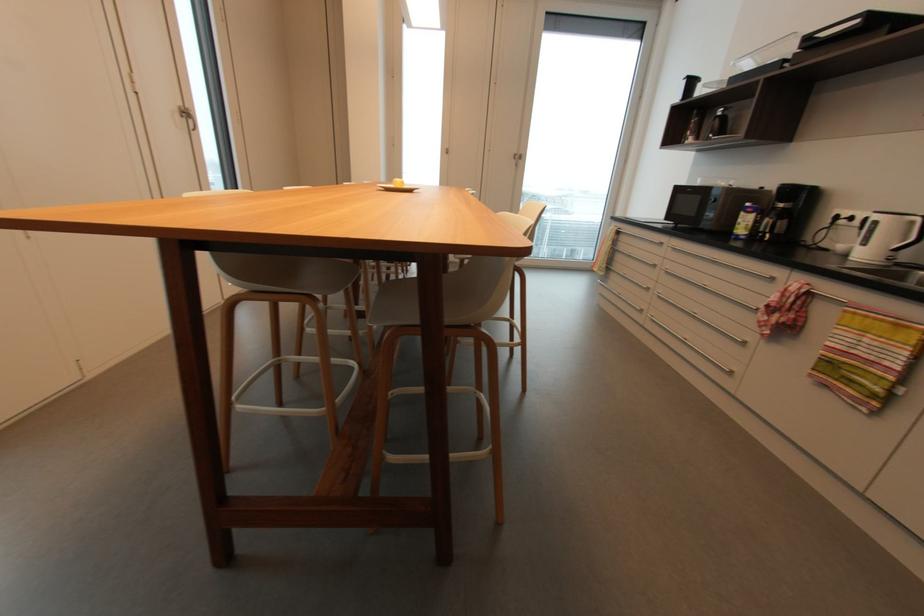
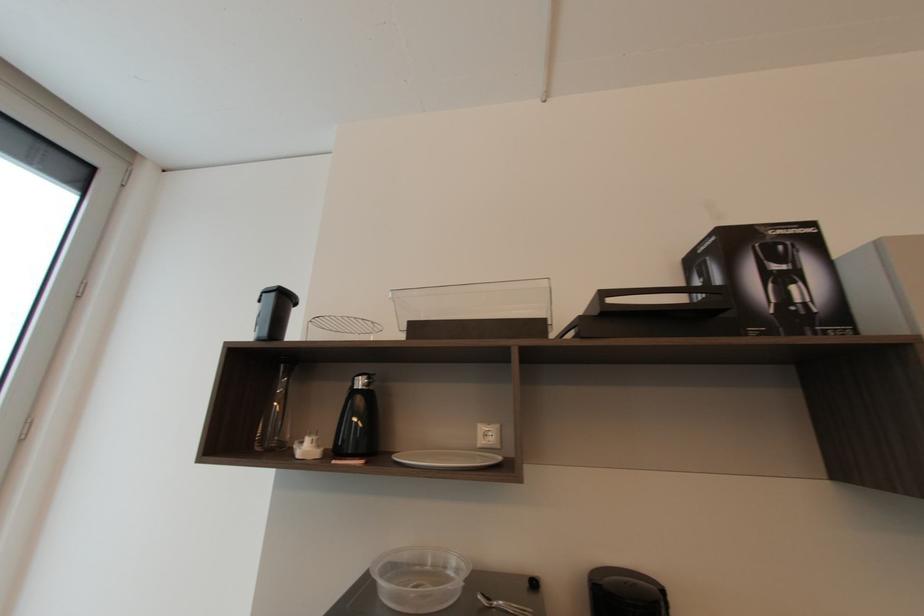
Locate, in the second image, the point that corresponds to the point at 723,113 in the first image.

(362, 384)